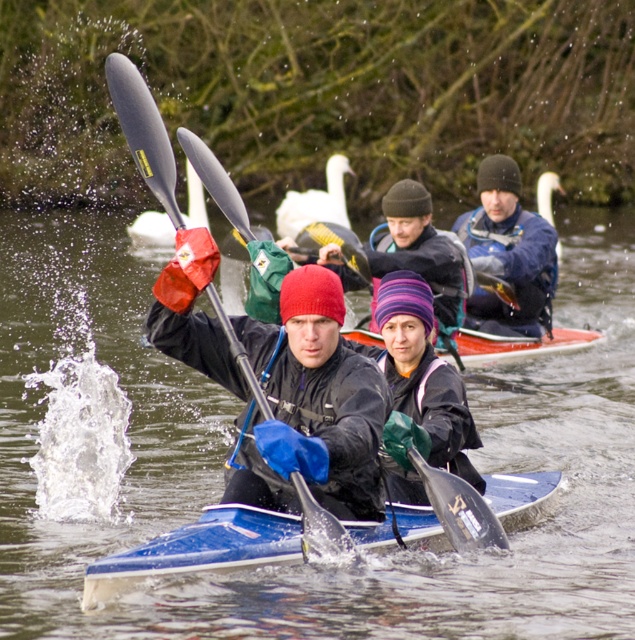
Does purple knit hat at center have a smaller size compared to white feathered swan at upper center?

Yes.

Is purple knit hat at center thinner than white feathered swan at upper center?

Yes.

You are a GUI agent. You are given a task and a screenshot of the screen. Output one action in this format:
    pyautogui.click(x=<x>, y=<y>)
    Task: Click on the purple knit hat at center
    
    Given the screenshot: What is the action you would take?
    pyautogui.click(x=418, y=250)

Who is positioned more to the right, clear water at center or matte black paddle at left?

Positioned to the right is matte black paddle at left.

Can you confirm if clear water at center is bigger than matte black paddle at left?

Yes.

Where is `clear water at center`? clear water at center is located at coordinates (231, 440).

Is clear water at center below orange plastic canoe at center?

Actually, clear water at center is above orange plastic canoe at center.

Between point (57, 627) and point (587, 346), which one is positioned in front?

Positioned in front is point (57, 627).

Which is behind, point (51, 262) or point (465, 344)?

The point (51, 262) is more distant.

Locate an element on the screen. clear water at center is located at coordinates (231, 440).